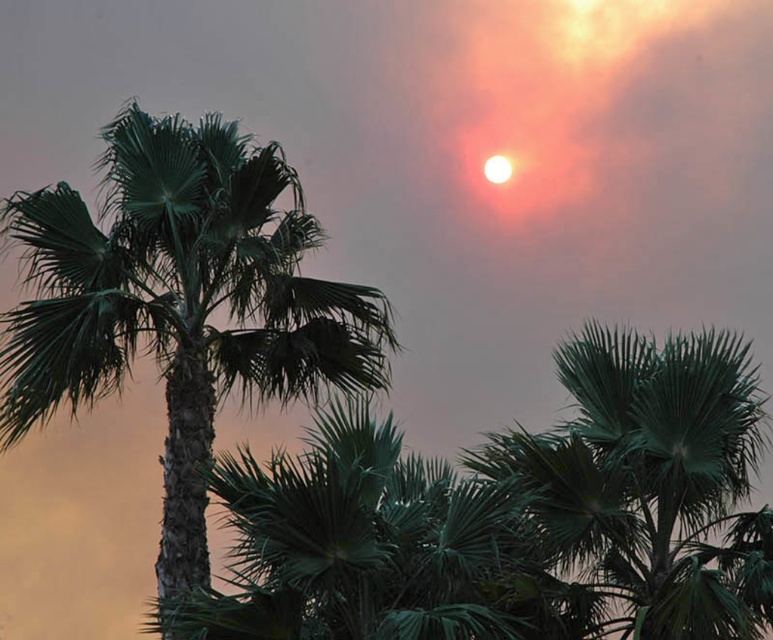
You are standing at the center of the image and want to locate the green leafy palm tree at center. What are the coordinates where you should look?

The green leafy palm tree at center is located at coordinates point (179,301).